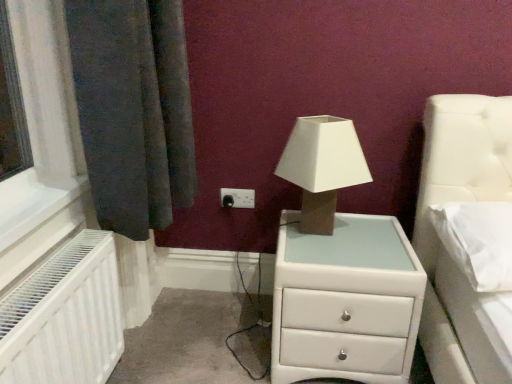
The height and width of the screenshot is (384, 512). I want to click on free point below matte beige cardboard at center (from a real-world perspective), so click(x=313, y=230).